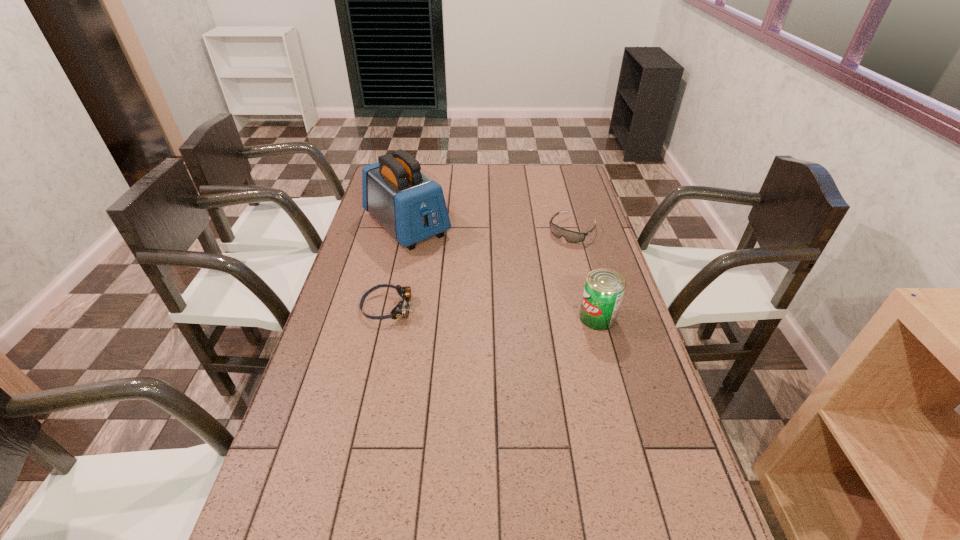
The height and width of the screenshot is (540, 960). What are the coordinates of `free space on the desktop that is between the nearer goggles and the second tallest object and is positioned on the lenses of the farther goggles` in the screenshot? It's located at (x=498, y=313).

Where is `vacant space on the desktop that is between the nearer goggles and the second tallest object and is positioned on the front-facing side of the toaster`? This screenshot has height=540, width=960. vacant space on the desktop that is between the nearer goggles and the second tallest object and is positioned on the front-facing side of the toaster is located at coordinates (503, 313).